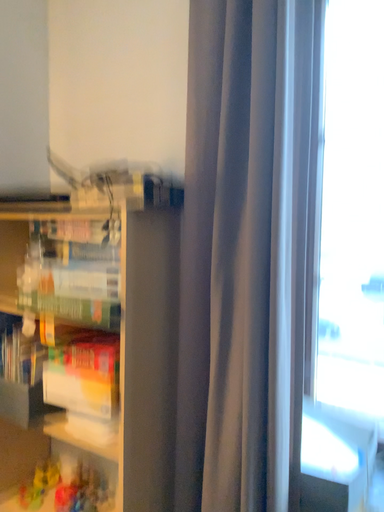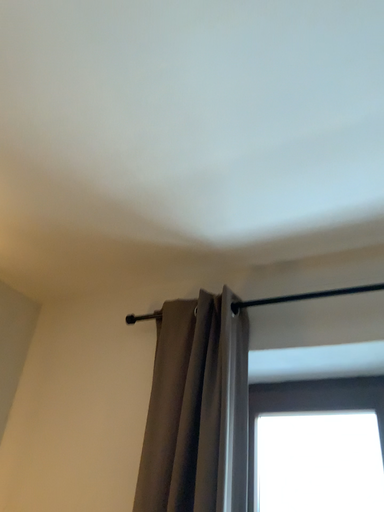
Question: How did the camera likely rotate when shooting the video?

Choices:
 (A) rotated downward
 (B) rotated upward

Answer: (B)